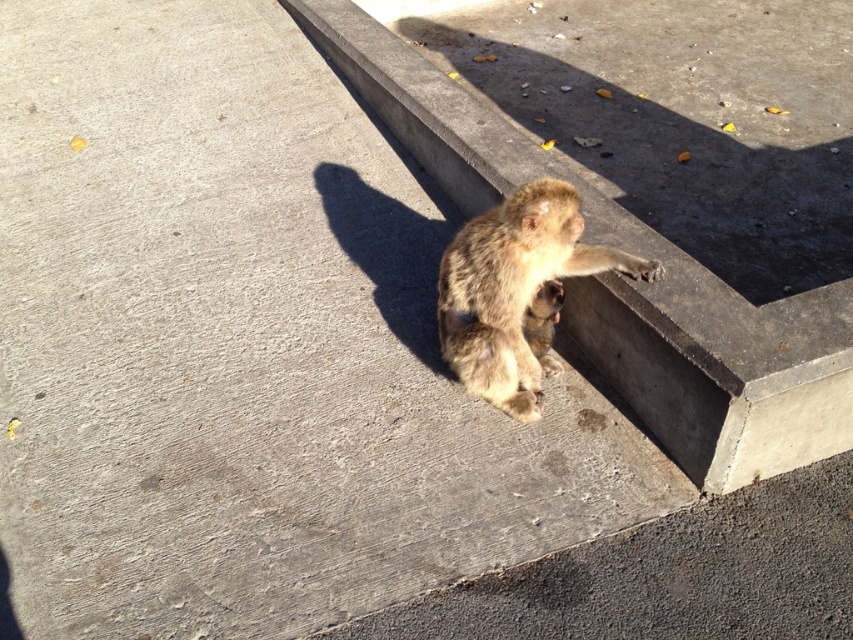
You are a zookeeper trying to place a food bowl between the concrete ledge at center and the fuzzy fur monkey at upper right. The bowl requires 24 inches of space to avoid tipping. Is there enough space between them?

The concrete ledge at center is 22.75 inches from the fuzzy fur monkey at upper right. Since the required space is 24 inches, the distance is insufficient, so the bowl cannot be placed there safely.

You are a zookeeper trying to place a new feeding tray for the monkeys. The feeding tray is as wide as the concrete ledge at center. Will the fuzzy fur monkey at upper right fit on the feeding tray without overhanging?

The concrete ledge at center is wider than the fuzzy fur monkey at upper right, so the feeding tray, being as wide as the ledge, will accommodate the monkey without overhanging.

You are a photographer trying to capture both the concrete ledge at center and the fuzzy fur monkey at upper right in a single shot. Which direction should you move your camera to ensure both are visible?

The concrete ledge at center is to the left of the fuzzy fur monkey at upper right, so you should move your camera slightly to the left to include both in the frame.